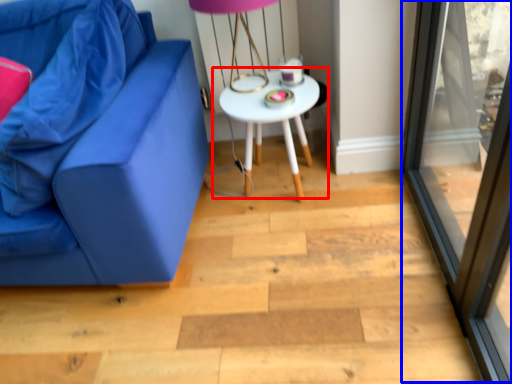
Question: Which object appears farthest to the camera in this image, table (highlighted by a red box) or screen door (highlighted by a blue box)?

Choices:
 (A) table
 (B) screen door

Answer: (A)